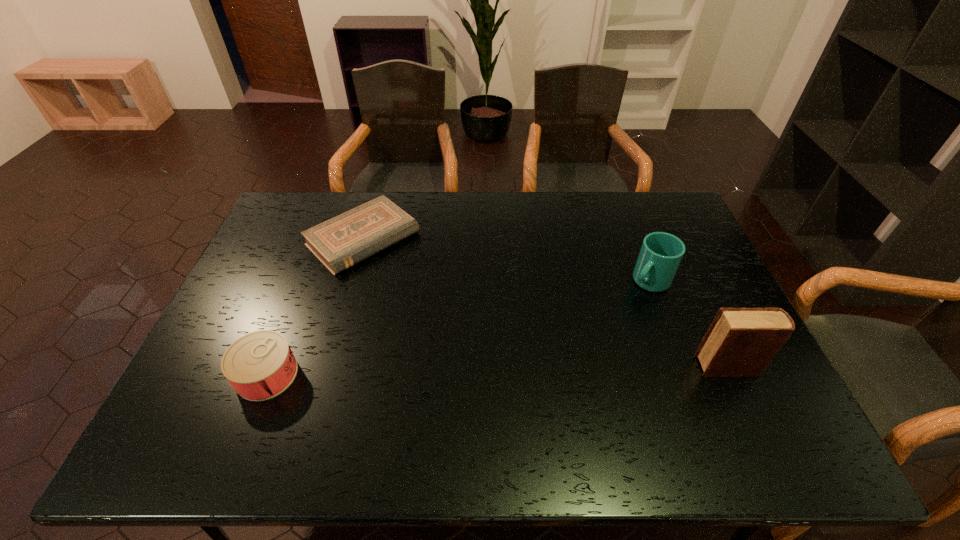
This screenshot has width=960, height=540. Find the location of `free space located on the handle side of the cup`. free space located on the handle side of the cup is located at coordinates (630, 301).

The height and width of the screenshot is (540, 960). I want to click on object located in the far edge section of the desktop, so click(347, 239).

The image size is (960, 540). Find the location of `object that is positioned at the near edge`. object that is positioned at the near edge is located at coordinates (260, 365).

Identify the location of can that is at the left edge. (260, 365).

I want to click on Bible situated at the left edge, so click(x=347, y=239).

This screenshot has height=540, width=960. Identify the location of diary positioned at the right edge. (740, 342).

Locate an element on the screen. Image resolution: width=960 pixels, height=540 pixels. cup located in the right edge section of the desktop is located at coordinates (661, 253).

This screenshot has width=960, height=540. Identify the location of object that is at the far left corner. coord(347,239).

Find the location of a particular element. The image size is (960, 540). object located at the near left corner is located at coordinates pos(260,365).

Identify the location of vacant space at the far edge. (484, 210).